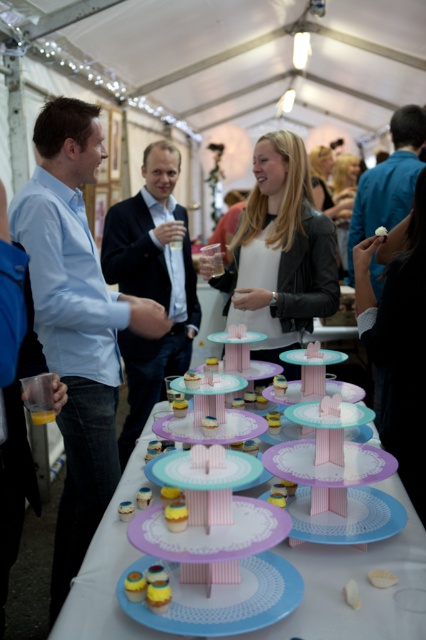
Question: Which point appears farthest from the camera in this image?

Choices:
 (A) (314, 349)
 (B) (385, 355)
 (C) (371, 515)
 (D) (307, 260)

Answer: (D)

Question: Can you confirm if blue shirt at left is positioned above pink paper plate at center?

Choices:
 (A) no
 (B) yes

Answer: (B)

Question: Can you confirm if blue fabric at right is wider than pink paper cupcake at center?

Choices:
 (A) no
 (B) yes

Answer: (B)

Question: Is blue paper plate at center behind pink paper cupcake at center?

Choices:
 (A) yes
 (B) no

Answer: (B)

Question: Which of these objects is positioned farthest from the pink paper plate at center?

Choices:
 (A) dark blue suit at center
 (B) pastel paper cupcake stands at center
 (C) white matte cookie at center

Answer: (A)

Question: Which object is the closest to the blue shirt at left?

Choices:
 (A) pastel paper cupcake stands at center
 (B) light blue paper plate at center
 (C) pink paper cupcake at center

Answer: (A)